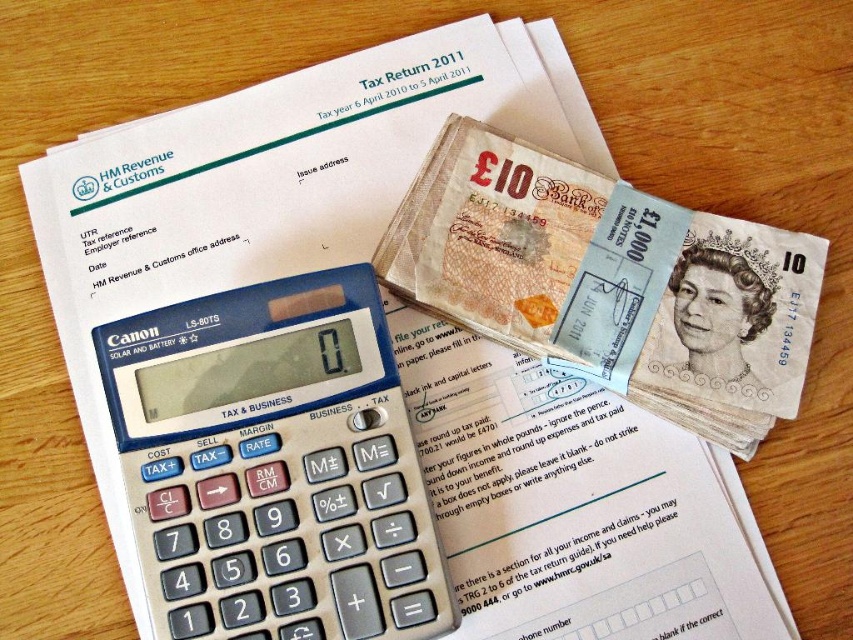
You are a tax accountant working on a desk with a Canon LS 80TS calculator and a stack of British 10 banknotes. You need to place a label on the desk at point (347, 372) and another label at point (776, 392). Which point will appear closer to you when you look at the desk?

Point (347, 372) is closer to the camera than point (776, 392), so the label placed at point (347, 372) will appear closer to you.